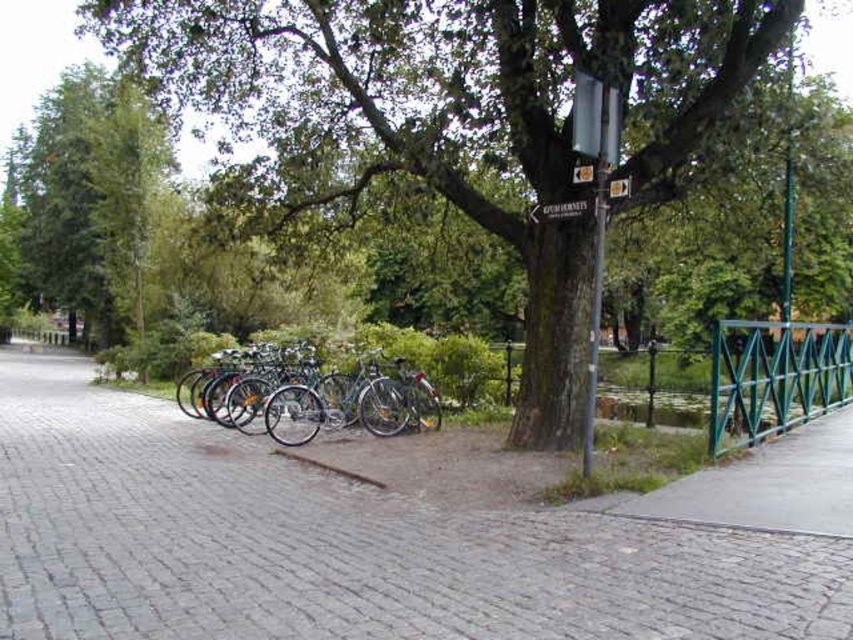
You are a maintenance worker needing to reach both the green metallic railing at right and the black plastic sign at upper center. If your ladder is 4 meters long, can you use it to safely reach both objects without moving it?

The distance between the green metallic railing at right and the black plastic sign at upper center is 4.16 meters, which exceeds the ladder length of 4 meters. Therefore, you cannot safely reach both objects with the ladder without moving it.

You are standing on the cobblestone pathway and want to find the green metal fence at right. According to the scene, where should you look relative to your position?

The green metal fence at right is located at point 0.309 on the x axis and 0.925 on the y axis, so you should look towards the upper right direction from your current position on the cobblestone pathway.

You are a visitor who just arrived at the park and see the green metal fence at right and the black plastic sign at upper center. According to the scene, which object is located to the right of the other?

The green metal fence at right is located to the right of the black plastic sign at upper center.